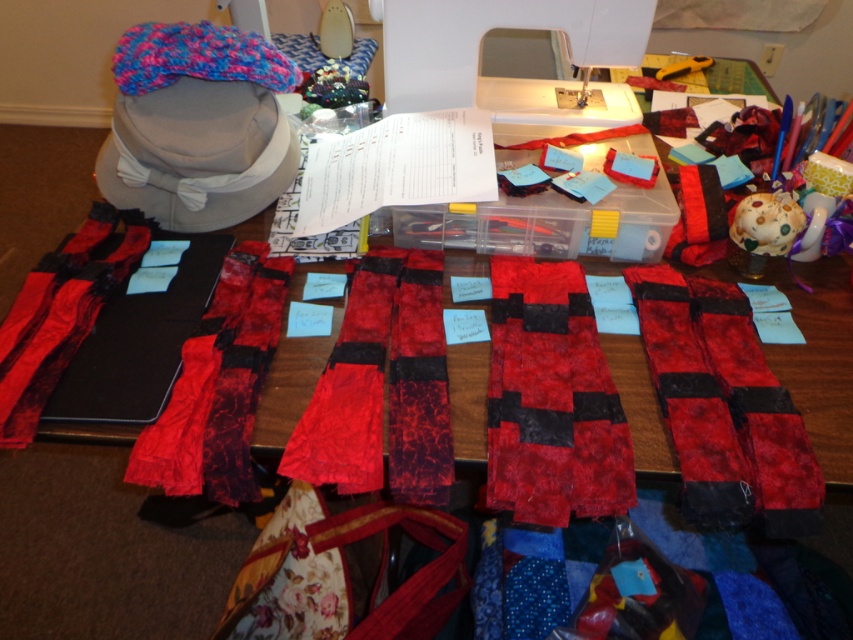
Which is more to the right, textured red fabric at center or knitted wool headband at upper left?

textured red fabric at center is more to the right.

Does point (593, 452) come behind point (132, 83)?

No.

Image resolution: width=853 pixels, height=640 pixels. In order to click on textured red fabric at center in this screenshot , I will do `click(550, 400)`.

Can you confirm if white plastic sewing machine at upper center is bigger than red velvet scarf at center?

Yes.

Is white plastic sewing machine at upper center shorter than red velvet scarf at center?

Indeed, white plastic sewing machine at upper center has a lesser height compared to red velvet scarf at center.

Which is behind, point (486, 1) or point (267, 307)?

The point (486, 1) is more distant.

In order to click on white plastic sewing machine at upper center in this screenshot , I will do `click(509, 77)`.

Does textured red fabric at center have a lesser height compared to white plastic sewing machine at upper center?

No, textured red fabric at center is not shorter than white plastic sewing machine at upper center.

Which is in front, point (525, 486) or point (387, 65)?

Point (525, 486) is more forward.

Locate an element on the screen. textured red fabric at center is located at coordinates [x=550, y=400].